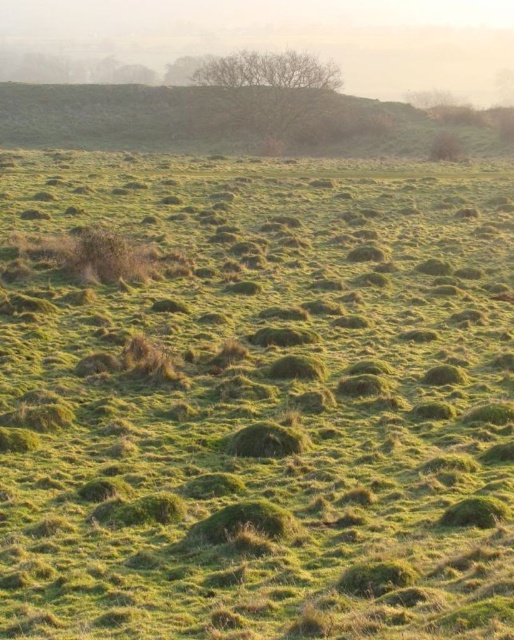
You are an outdoor photographer planning to capture a landscape shot of the foggy mist at upper center and the green grassy hillside at upper center. Which of these two elements will appear taller in your photo?

The foggy mist at upper center appears taller than the green grassy hillside at upper center in the image.

You are a hiker planning to traverse the landscape shown in the image. You notice the foggy mist at upper center and the green grassy hillside at upper center. Which of these two features is positioned higher in the scene?

The foggy mist at upper center is above the green grassy hillside at upper center, so the foggy mist at upper center is higher in the scene.